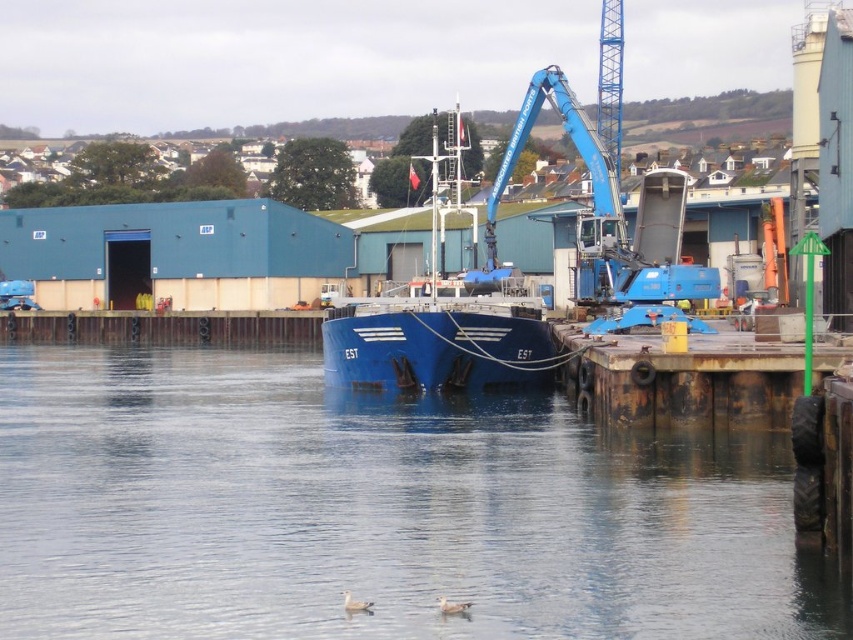
You are a dock worker who needs to secure the blue matte boat at center to the pier. The transparent water at center is flowing around it. Considering the width of both, which one is wider?

The transparent water at center is wider than the blue matte boat at center, so the water has a greater width.

You are a birdwatcher observing the scene from the pier. You notice the blue matte boat at center and the white feathered duck at lower center. Which object is taller?

The blue matte boat at center is much taller than the white feathered duck at lower center.